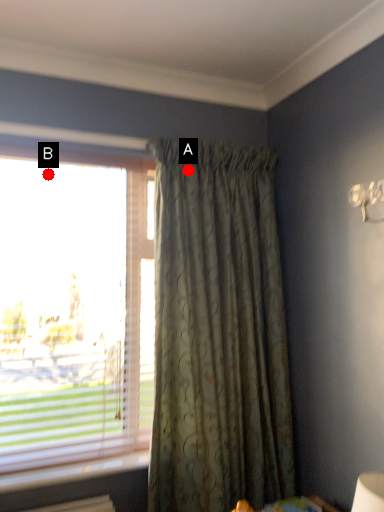
Question: Two points are circled on the image, labeled by A and B beside each circle. Which of the following is the closest to the observer?

Choices:
 (A) A is closer
 (B) B is closer

Answer: (B)